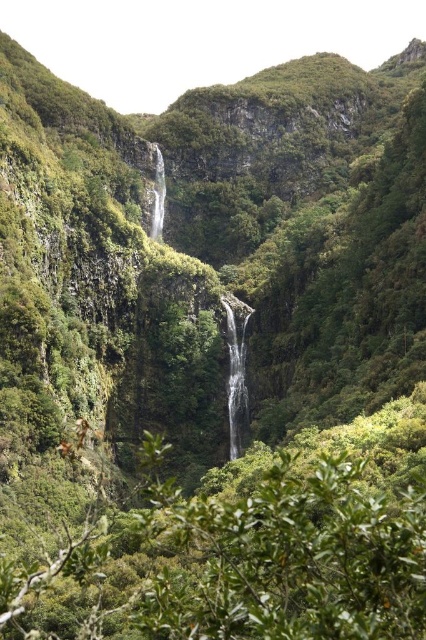
You are a hiker planning to cross the valley using a bridge that is 28 meters long. You spot the white smooth waterfall at center and the transparent glass waterfall at center in the distance. Can your bridge span the gap between them?

The white smooth waterfall at center and transparent glass waterfall at center are 28.35 meters apart from each other. Since the bridge is only 28 meters long, it is 0.35 meters shorter than the required distance. Therefore, the bridge cannot span the gap between them.

You are a photographer planning to capture both the white smooth waterfall at center and the transparent glass waterfall at center in a single shot. Given that your camera can only focus on one waterfall at a time, which waterfall should you choose to ensure it appears larger in the photo?

The white smooth waterfall at center is larger in size than the transparent glass waterfall at center, so you should focus on the white smooth waterfall at center to ensure it appears larger in the photo.